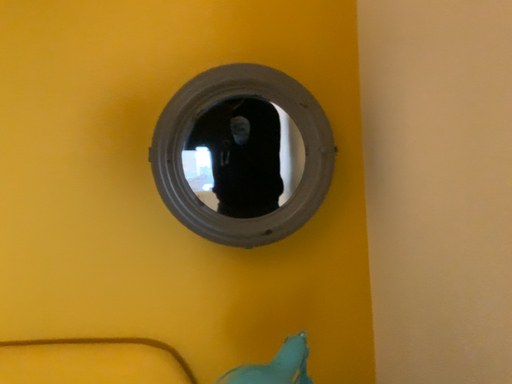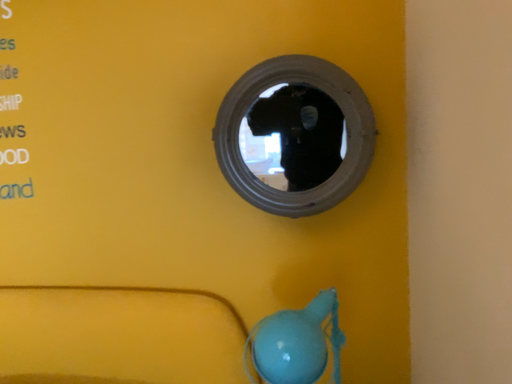
Question: Which way did the camera rotate in the video?

Choices:
 (A) rotated left
 (B) rotated right

Answer: (A)